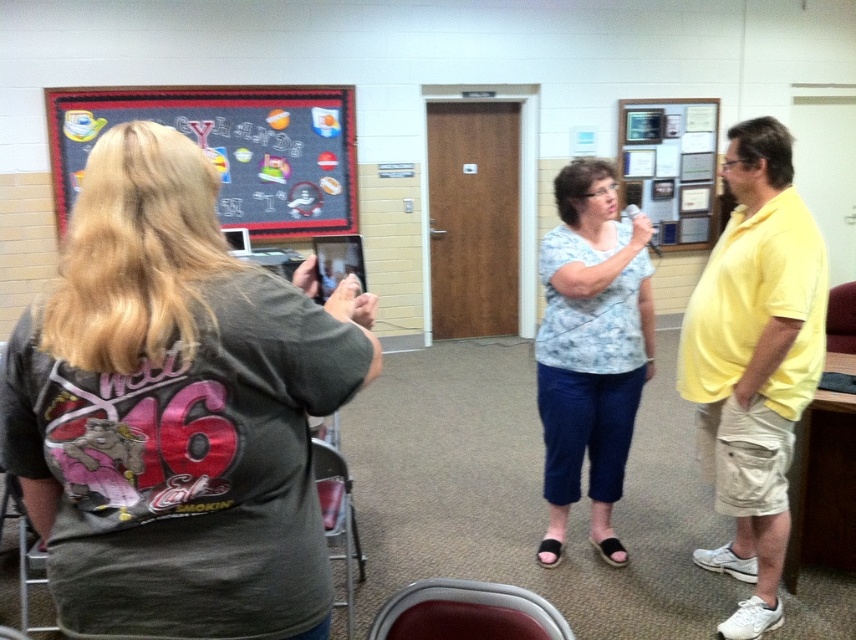
Question: Does yellow cotton shirt at center come behind blackboard with stickers at upper left?

Choices:
 (A) no
 (B) yes

Answer: (A)

Question: Estimate the real-world distances between objects in this image. Which object is closer to the light blue printed blouse at center?

Choices:
 (A) dark gray t-shirt at left
 (B) yellow cotton shirt at center

Answer: (B)

Question: Can you confirm if dark gray t-shirt at left is smaller than blackboard with stickers at upper left?

Choices:
 (A) no
 (B) yes

Answer: (B)

Question: Among these objects, which one is nearest to the camera?

Choices:
 (A) blackboard with stickers at upper left
 (B) dark gray t-shirt at left
 (C) light blue printed blouse at center
 (D) yellow cotton shirt at center

Answer: (B)

Question: Which point is closer to the camera taking this photo?

Choices:
 (A) (603, 208)
 (B) (265, 420)
 (C) (697, 288)
 (D) (242, 125)

Answer: (B)

Question: Does yellow cotton shirt at center appear over light blue printed blouse at center?

Choices:
 (A) yes
 (B) no

Answer: (B)